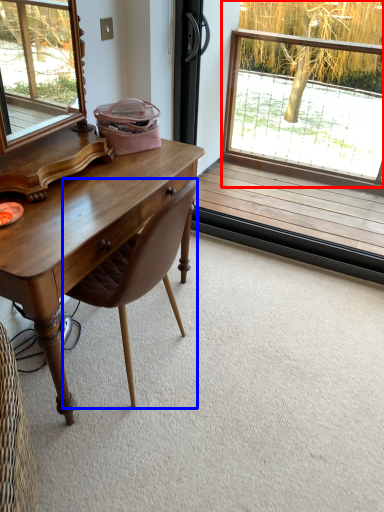
Question: Which of the following is the farthest to the observer, window (highlighted by a red box) or chair (highlighted by a blue box)?

Choices:
 (A) window
 (B) chair

Answer: (A)